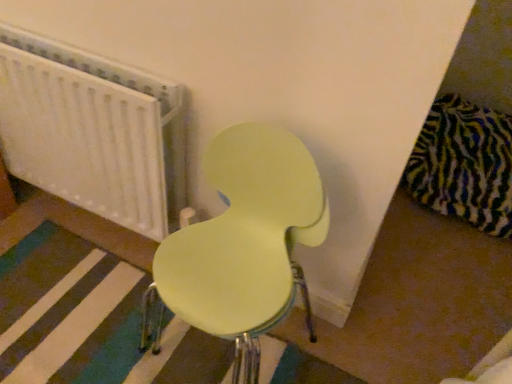
Question: From a real-world perspective, is white textured radiator at upper left physically located above or below matte yellow chair at center?

Choices:
 (A) below
 (B) above

Answer: (A)

Question: Relative to matte yellow chair at center, is white textured radiator at upper left in front or behind?

Choices:
 (A) front
 (B) behind

Answer: (B)

Question: Considering the positions of white textured radiator at upper left and matte yellow chair at center in the image, is white textured radiator at upper left wider or thinner than matte yellow chair at center?

Choices:
 (A) thin
 (B) wide

Answer: (A)

Question: Considering the positions of matte yellow chair at center and white textured radiator at upper left in the image, is matte yellow chair at center wider or thinner than white textured radiator at upper left?

Choices:
 (A) wide
 (B) thin

Answer: (A)

Question: Considering their positions, is matte yellow chair at center located in front of or behind white textured radiator at upper left?

Choices:
 (A) behind
 (B) front

Answer: (B)

Question: Is matte yellow chair at center situated inside white textured radiator at upper left or outside?

Choices:
 (A) inside
 (B) outside

Answer: (B)

Question: Considering the positions of matte yellow chair at center and white textured radiator at upper left in the image, is matte yellow chair at center taller or shorter than white textured radiator at upper left?

Choices:
 (A) tall
 (B) short

Answer: (A)